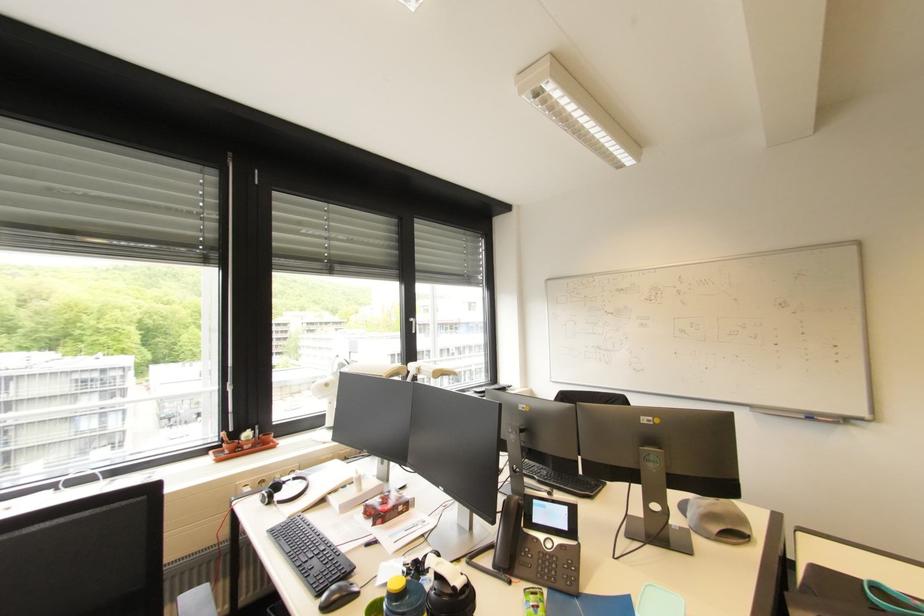
Where is `yellow lidded cup`? This screenshot has height=616, width=924. yellow lidded cup is located at coordinates (399, 599).